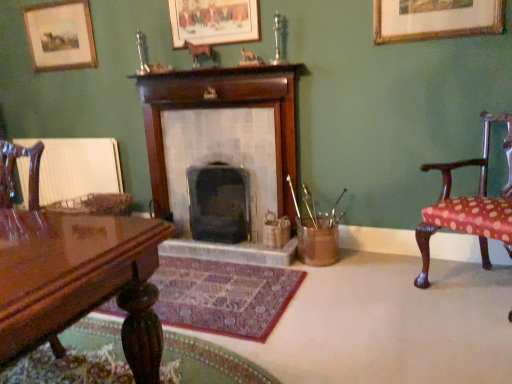
Question: Can you confirm if gold-framed picture at upper right, acting as the third picture frame starting from the left, is bigger than matte wooden picture frame at upper left, which appears as the third picture frame when viewed from the right?

Choices:
 (A) no
 (B) yes

Answer: (A)

Question: Can you confirm if gold-framed picture at upper right, the first picture frame in the right-to-left sequence, is positioned to the left of matte wooden picture frame at upper left, the 1th picture frame from the back?

Choices:
 (A) no
 (B) yes

Answer: (A)

Question: Is gold-framed picture at upper right, arranged as the first picture frame when viewed from the front, closer to the viewer compared to matte wooden picture frame at upper left, the 1th picture frame from the back?

Choices:
 (A) yes
 (B) no

Answer: (A)

Question: Considering the relative sizes of gold-framed picture at upper right, which ranks as the 3th picture frame in back-to-front order, and matte wooden picture frame at upper left, the 1th picture frame from the back, in the image provided, is gold-framed picture at upper right, which ranks as the 3th picture frame in back-to-front order, shorter than matte wooden picture frame at upper left, the 1th picture frame from the back,?

Choices:
 (A) yes
 (B) no

Answer: (A)

Question: Is gold-framed picture at upper right, arranged as the first picture frame when viewed from the front, behind matte wooden picture frame at upper left, which is counted as the first picture frame, starting from the left?

Choices:
 (A) yes
 (B) no

Answer: (B)

Question: From the image's perspective, does gold-framed picture at upper right, acting as the third picture frame starting from the left, appear higher than matte wooden picture frame at upper left, which appears as the third picture frame when viewed from the right?

Choices:
 (A) yes
 (B) no

Answer: (B)

Question: Is polka dot fabric chair at right, which is the second chair in left-to-right order, shorter than shiny brown wood chair at left, which is the second chair from right to left?

Choices:
 (A) no
 (B) yes

Answer: (B)

Question: Can we say polka dot fabric chair at right, which is the second chair in left-to-right order, lies outside shiny brown wood chair at left, which is the second chair from right to left?

Choices:
 (A) no
 (B) yes

Answer: (B)

Question: Is polka dot fabric chair at right, the first chair viewed from the right, at the left side of shiny brown wood chair at left, marked as the 1th chair in a left-to-right arrangement?

Choices:
 (A) no
 (B) yes

Answer: (A)

Question: Is polka dot fabric chair at right, the first chair viewed from the right, looking in the opposite direction of shiny brown wood chair at left, which is the second chair from right to left?

Choices:
 (A) yes
 (B) no

Answer: (B)

Question: From a real-world perspective, does polka dot fabric chair at right, the first chair viewed from the right, stand above shiny brown wood chair at left, which is the second chair from right to left?

Choices:
 (A) yes
 (B) no

Answer: (B)

Question: From the image's perspective, is polka dot fabric chair at right, which is the second chair in left-to-right order, above shiny brown wood chair at left, marked as the 1th chair in a left-to-right arrangement?

Choices:
 (A) no
 (B) yes

Answer: (B)

Question: Is wooden fireplace at center, the 2th fireplace in the right-to-left sequence, positioned beyond the bounds of matte wooden picture frame at upper left, which is counted as the first picture frame, starting from the left?

Choices:
 (A) yes
 (B) no

Answer: (A)